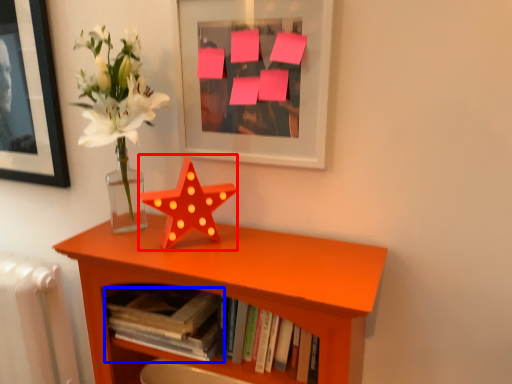
Question: Among these objects, which one is farthest to the camera, flower (highlighted by a red box) or book (highlighted by a blue box)?

Choices:
 (A) flower
 (B) book

Answer: (B)